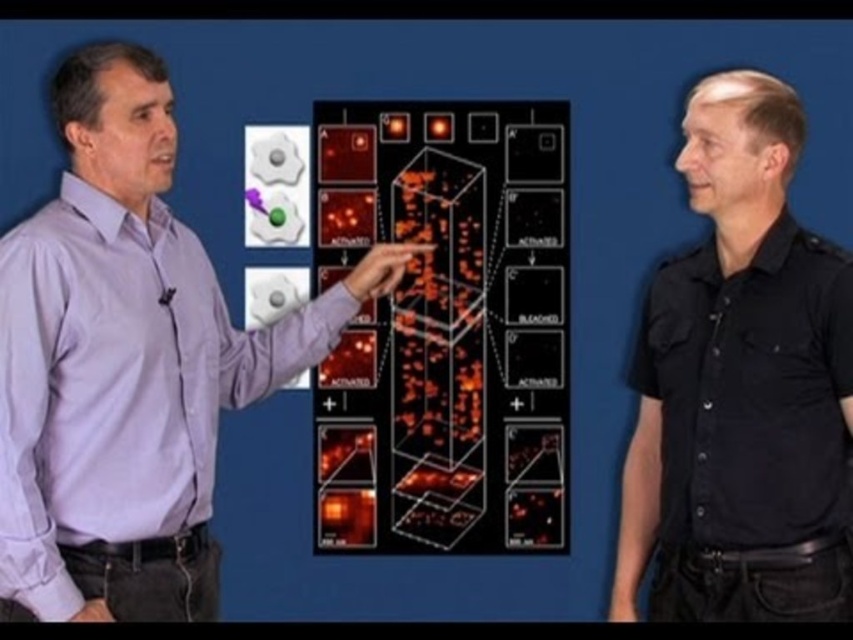
Question: Can you confirm if purple shirt at center is positioned to the left of black cotton shirt at right?

Choices:
 (A) yes
 (B) no

Answer: (A)

Question: Which point appears farthest from the camera in this image?

Choices:
 (A) (x=138, y=202)
 (B) (x=695, y=586)

Answer: (A)

Question: Is purple shirt at center bigger than black cotton shirt at right?

Choices:
 (A) no
 (B) yes

Answer: (B)

Question: Considering the relative positions of purple shirt at center and black cotton shirt at right in the image provided, where is purple shirt at center located with respect to black cotton shirt at right?

Choices:
 (A) left
 (B) right

Answer: (A)

Question: Which point is closer to the camera taking this photo?

Choices:
 (A) (51, 321)
 (B) (779, 429)

Answer: (A)